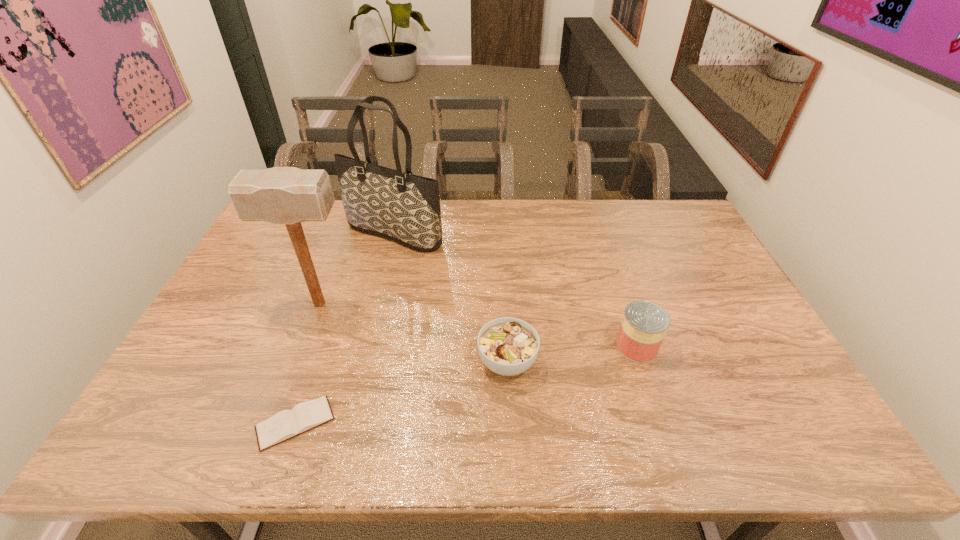
Identify the location of free point between the second shortest object and the rightmost object. This screenshot has height=540, width=960. (572, 354).

Where is `blank region between the diary and the fourth nearest object`? blank region between the diary and the fourth nearest object is located at coordinates (307, 363).

Where is `empty location between the soup bowl and the nearest object`? The image size is (960, 540). empty location between the soup bowl and the nearest object is located at coordinates (401, 393).

Find the location of `blank region between the farthest object and the soup bowl`. blank region between the farthest object and the soup bowl is located at coordinates (450, 298).

You are a GUI agent. You are given a task and a screenshot of the screen. Output one action in this format:
    pyautogui.click(x=<x>, y=<y>)
    Task: Click on the unoccupied area between the tote bag and the diary
    This screenshot has width=960, height=540.
    Given the screenshot: What is the action you would take?
    pyautogui.click(x=345, y=329)

You are a GUI agent. You are given a task and a screenshot of the screen. Output one action in this format:
    pyautogui.click(x=<x>, y=<y>)
    Task: Click on the empty location between the farthest object and the nearest object
    
    Given the screenshot: What is the action you would take?
    pyautogui.click(x=345, y=329)

Find the location of a particular element. The height and width of the screenshot is (540, 960). free spot between the farthest object and the soup bowl is located at coordinates (450, 298).

Identify the location of vacant area between the soup bowl and the rightmost object. (572, 354).

Locate which object is the closest to the tote bag. Please provide its 2D coordinates. Your answer should be formatted as a tuple, i.e. [(x, y)], where the tuple contains the x and y coordinates of a point satisfying the conditions above.

[(281, 195)]

At what (x,y) coordinates should I click in order to perform the action: click on object that is the third closest one to the tote bag. Please return your answer as a coordinate pair (x, y). This screenshot has height=540, width=960. Looking at the image, I should click on (286, 424).